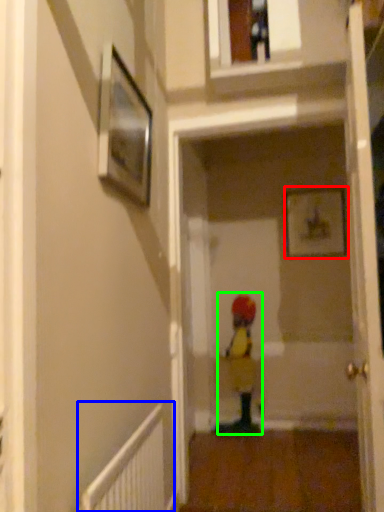
Question: Which object is the farthest from picture frame (highlighted by a red box)? Choose among these: radiator (highlighted by a blue box) or toddler (highlighted by a green box).

Choices:
 (A) radiator
 (B) toddler

Answer: (A)